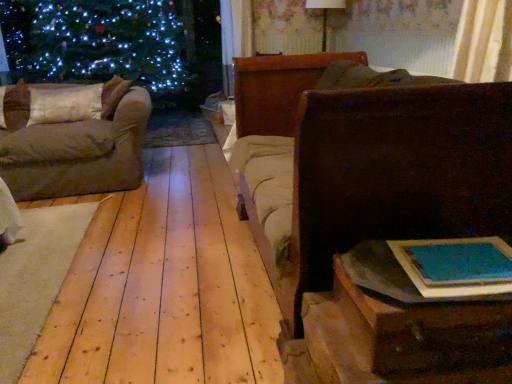
Question: Is dark brown wood chest at right not inside wooden table at lower right?

Choices:
 (A) no
 (B) yes

Answer: (B)

Question: Considering the relative sizes of dark brown wood chest at right and wooden table at lower right in the image provided, is dark brown wood chest at right thinner than wooden table at lower right?

Choices:
 (A) no
 (B) yes

Answer: (A)

Question: Is dark brown wood chest at right wider than wooden table at lower right?

Choices:
 (A) yes
 (B) no

Answer: (A)

Question: Can you confirm if dark brown wood chest at right is smaller than wooden table at lower right?

Choices:
 (A) yes
 (B) no

Answer: (B)

Question: Considering the relative sizes of dark brown wood chest at right and wooden table at lower right in the image provided, is dark brown wood chest at right shorter than wooden table at lower right?

Choices:
 (A) yes
 (B) no

Answer: (B)

Question: Is dark brown wood chest at right bigger than wooden table at lower right?

Choices:
 (A) yes
 (B) no

Answer: (A)

Question: Considering the relative positions of dark brown wood chest at right and brown fabric couch at left in the image provided, is dark brown wood chest at right to the left of brown fabric couch at left from the viewer's perspective?

Choices:
 (A) no
 (B) yes

Answer: (A)

Question: Can you confirm if dark brown wood chest at right is thinner than brown fabric couch at left?

Choices:
 (A) no
 (B) yes

Answer: (B)

Question: Does dark brown wood chest at right have a greater width compared to brown fabric couch at left?

Choices:
 (A) yes
 (B) no

Answer: (B)

Question: From the image's perspective, would you say dark brown wood chest at right is shown under brown fabric couch at left?

Choices:
 (A) no
 (B) yes

Answer: (B)

Question: Is dark brown wood chest at right not close to brown fabric couch at left?

Choices:
 (A) yes
 (B) no

Answer: (A)

Question: Considering the relative positions of dark brown wood chest at right and brown fabric couch at left in the image provided, is dark brown wood chest at right to the right of brown fabric couch at left from the viewer's perspective?

Choices:
 (A) yes
 (B) no

Answer: (A)

Question: Can you confirm if blue paper book at lower right is thinner than white fabric pillow at left?

Choices:
 (A) yes
 (B) no

Answer: (B)